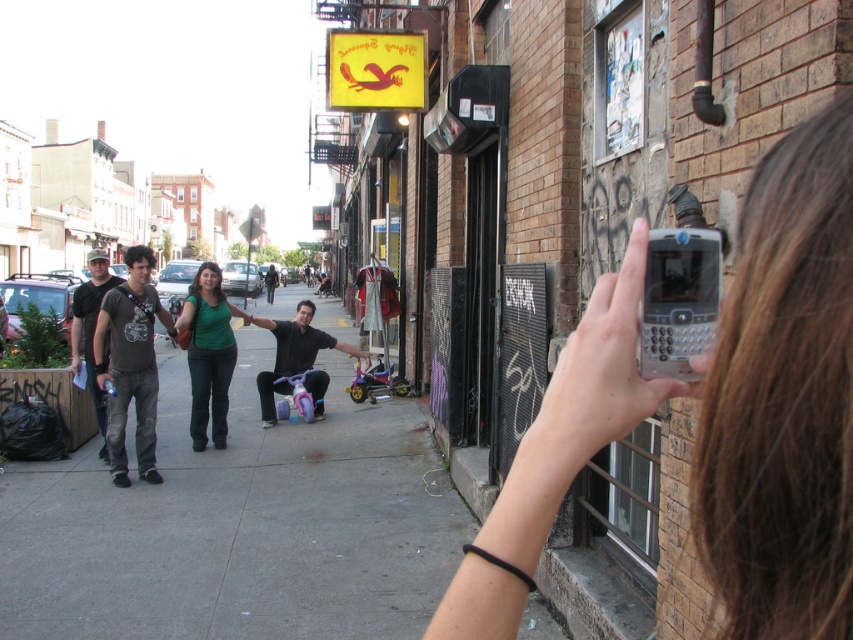
You are a photographer trying to decide which object to focus on in the scene. The clear plastic phone at center and the matte black tricycle at center are both in your frame. Which object is thinner?

The clear plastic phone at center is thinner than the matte black tricycle at center.

You are a delivery rider who needs to park your matte black tricycle at center near the gray concrete sidewalk at center. Can you park your tricycle there without it sticking out of the sidewalk?

The gray concrete sidewalk at center might be wider than matte black tricycle at center, so there is a possibility that the tricycle can be parked within the sidewalk without sticking out. However, since the exact width comparison is uncertain, it is recommended to check the space carefully before parking.